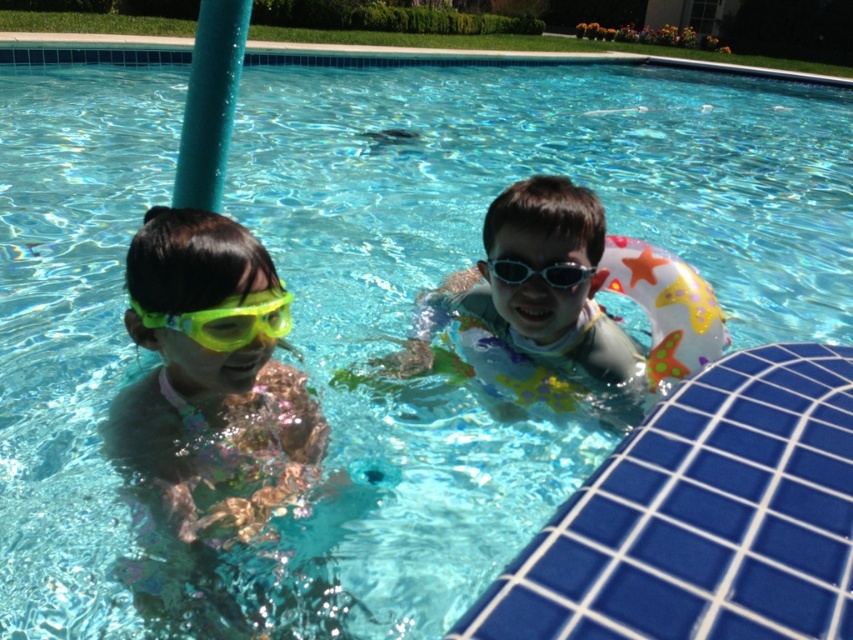
Measure the distance between neon yellow goggles at left and transparent plastic goggles at center.

neon yellow goggles at left is 28.22 inches away from transparent plastic goggles at center.

Is point (294, 449) farther from camera compared to point (589, 273)?

No, (294, 449) is in front of (589, 273).

This screenshot has width=853, height=640. Identify the location of neon yellow goggles at left. [212, 376].

Does translucent rubber ring at center appear on the right side of transparent plastic goggles at center?

Yes, translucent rubber ring at center is to the right of transparent plastic goggles at center.

Does point (585, 253) lie in front of point (556, 276)?

No, it is behind (556, 276).

Is point (567, 285) more distant than point (566, 269)?

Yes, point (567, 285) is farther from viewer.

Locate an element on the screen. The width and height of the screenshot is (853, 640). translucent rubber ring at center is located at coordinates (550, 291).

Locate an element on the screen. The width and height of the screenshot is (853, 640). translucent rubber ring at center is located at coordinates (550, 291).

Is the position of translucent rubber ring at center more distant than that of yellow-green plastic goggles at left?

Yes, it is behind yellow-green plastic goggles at left.

Which is in front, point (454, 292) or point (154, 321)?

Point (154, 321)

What are the coordinates of `translucent rubber ring at center` in the screenshot? It's located at (550, 291).